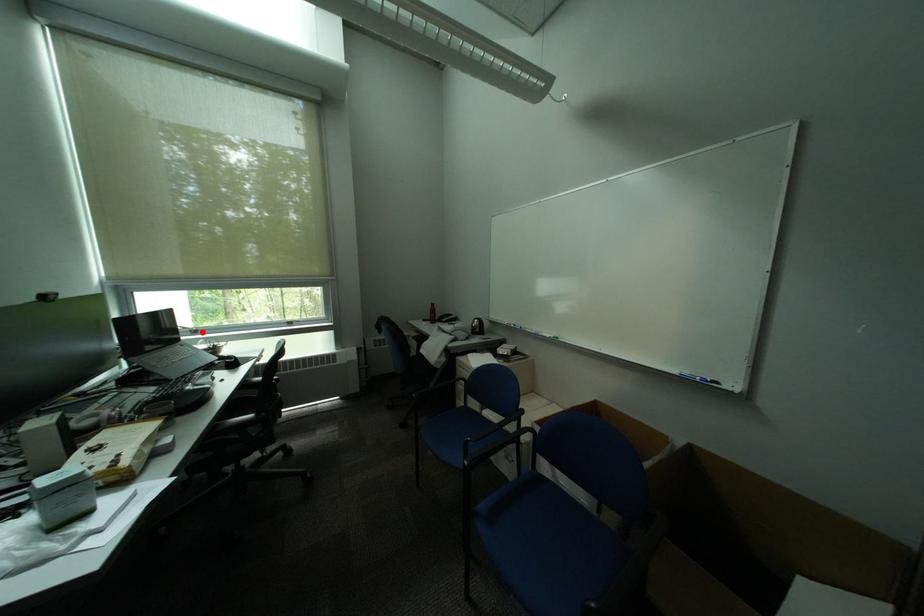
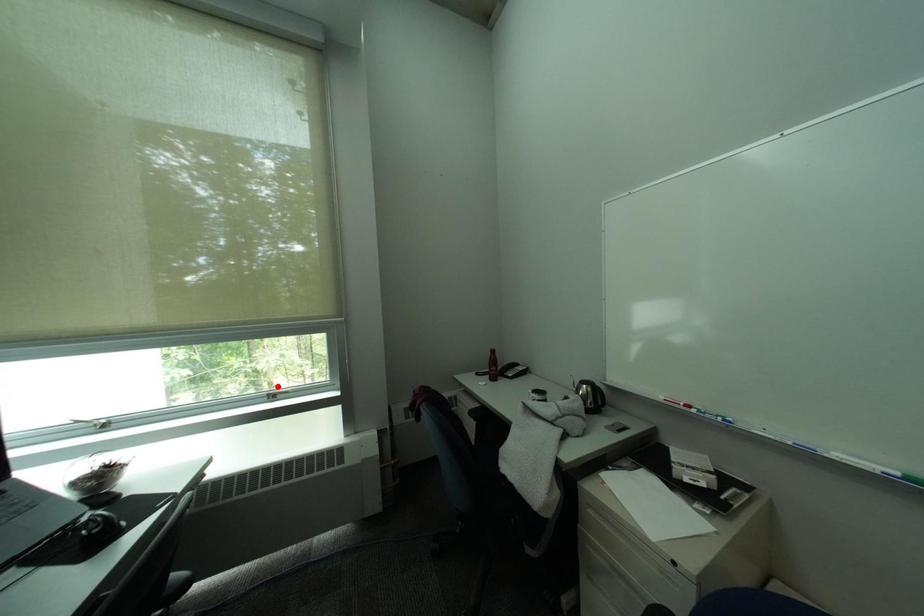
I am providing you with two images of the same scene from different viewpoints. A red point is marked on the first image and another point is marked on the second image. Is the red point in image1 aligned with the point shown in image2?

No